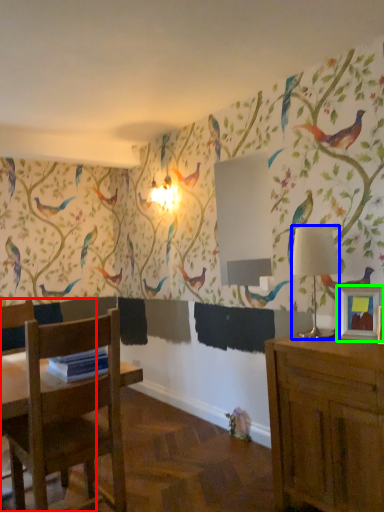
Question: Based on their relative distances, which object is farther from chair (highlighted by a red box)? Choose from lamp (highlighted by a blue box) and picture frame (highlighted by a green box).

Choices:
 (A) lamp
 (B) picture frame

Answer: (B)